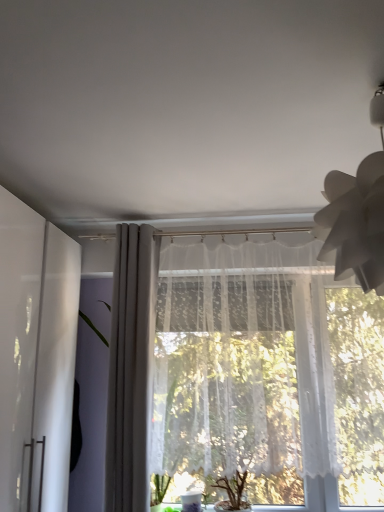
Question: From the image's perspective, is white glossy cabinet at left located above or below white lace curtain at center, positioned as the 2th curtain in left-to-right order?

Choices:
 (A) below
 (B) above

Answer: (A)

Question: Considering the relative positions of white glossy cabinet at left and white lace curtain at center, which is the 1th curtain in right-to-left order, in the image provided, is white glossy cabinet at left to the left or to the right of white lace curtain at center, which is the 1th curtain in right-to-left order,?

Choices:
 (A) left
 (B) right

Answer: (A)

Question: Which object is positioned closest to the white paper lampshade at upper right?

Choices:
 (A) white glossy cabinet at left
 (B) white sheer curtain at center, the 2th curtain when ordered from right to left
 (C) transparent glass vase at lower center
 (D) white lace curtain at center, positioned as the 2th curtain in left-to-right order

Answer: (D)

Question: Considering the real-world distances, which object is farthest from the white paper lampshade at upper right?

Choices:
 (A) transparent glass vase at lower center
 (B) white sheer curtain at center, the 2th curtain when ordered from right to left
 (C) white lace curtain at center, positioned as the 2th curtain in left-to-right order
 (D) white glossy cabinet at left

Answer: (A)